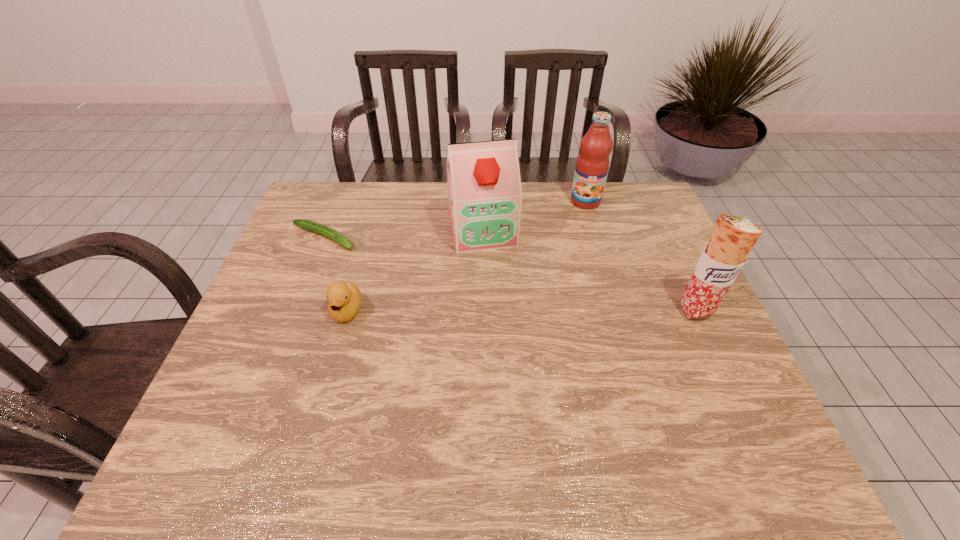
This screenshot has height=540, width=960. I want to click on free space between the burrito and the zucchini, so 510,274.

Locate an element on the screen. The height and width of the screenshot is (540, 960). free space that is in between the fruit juice and the fourth tallest object is located at coordinates (467, 256).

This screenshot has height=540, width=960. Identify the location of free space between the duckling and the rightmost object. (521, 310).

The image size is (960, 540). Identify the location of unoccupied area between the soya milk and the fourth object from left to right. (534, 216).

Where is `free area in between the zucchini and the soya milk`? This screenshot has height=540, width=960. free area in between the zucchini and the soya milk is located at coordinates (403, 234).

Identify the location of empty space that is in between the shortest object and the second shortest object. (335, 275).

Where is `the closest object relative to the fruit juice`? the closest object relative to the fruit juice is located at coordinates (485, 194).

Find the location of a particular element. The width and height of the screenshot is (960, 540). object that can be found as the second closest to the third object from right to left is located at coordinates (344, 298).

At what (x,y) coordinates should I click in order to perform the action: click on vacant space that satisfies the following two spatial constraints: 1. on the front side of the soya milk; 2. on the left side of the burrito. Please return your answer as a coordinate pair (x, y). Looking at the image, I should click on (483, 310).